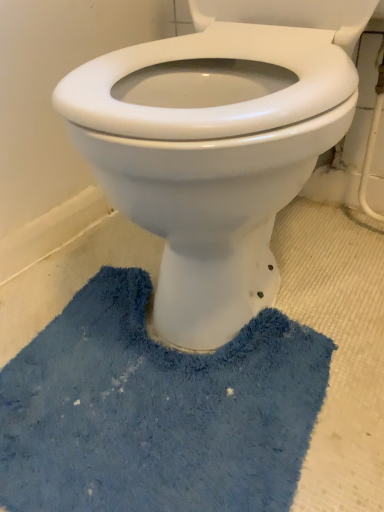
Question: Does blue fuzzy bath mat at lower center have a lesser height compared to white glossy toilet at center?

Choices:
 (A) yes
 (B) no

Answer: (A)

Question: From a real-world perspective, is blue fuzzy bath mat at lower center physically below white glossy toilet at center?

Choices:
 (A) yes
 (B) no

Answer: (A)

Question: Does blue fuzzy bath mat at lower center have a smaller size compared to white glossy toilet at center?

Choices:
 (A) no
 (B) yes

Answer: (B)

Question: Is blue fuzzy bath mat at lower center surrounding white glossy toilet at center?

Choices:
 (A) yes
 (B) no

Answer: (B)

Question: Could you tell me if blue fuzzy bath mat at lower center is turned towards white glossy toilet at center?

Choices:
 (A) yes
 (B) no

Answer: (B)

Question: Is blue fuzzy bath mat at lower center not close to white glossy toilet at center?

Choices:
 (A) yes
 (B) no

Answer: (B)

Question: Is white glossy toilet at center aimed at blue fuzzy bath mat at lower center?

Choices:
 (A) no
 (B) yes

Answer: (A)

Question: Does white glossy toilet at center have a greater height compared to blue fuzzy bath mat at lower center?

Choices:
 (A) yes
 (B) no

Answer: (A)

Question: From a real-world perspective, is white glossy toilet at center located beneath blue fuzzy bath mat at lower center?

Choices:
 (A) yes
 (B) no

Answer: (B)

Question: From a real-world perspective, is white glossy toilet at center on blue fuzzy bath mat at lower center?

Choices:
 (A) yes
 (B) no

Answer: (A)

Question: Is white glossy toilet at center oriented away from blue fuzzy bath mat at lower center?

Choices:
 (A) no
 (B) yes

Answer: (A)

Question: From the image's perspective, is white glossy toilet at center located beneath blue fuzzy bath mat at lower center?

Choices:
 (A) yes
 (B) no

Answer: (B)

Question: From their relative heights in the image, would you say blue fuzzy bath mat at lower center is taller or shorter than white glossy toilet at center?

Choices:
 (A) tall
 (B) short

Answer: (B)